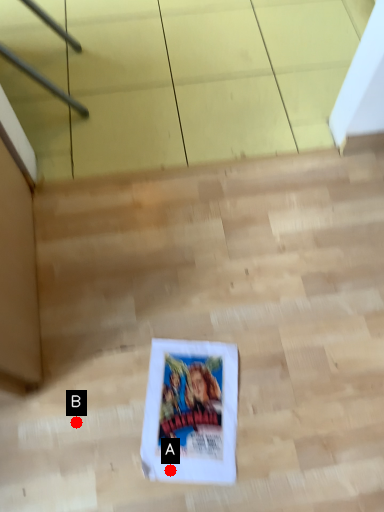
Question: Two points are circled on the image, labeled by A and B beside each circle. Which point appears closest to the camera in this image?

Choices:
 (A) A is closer
 (B) B is closer

Answer: (A)